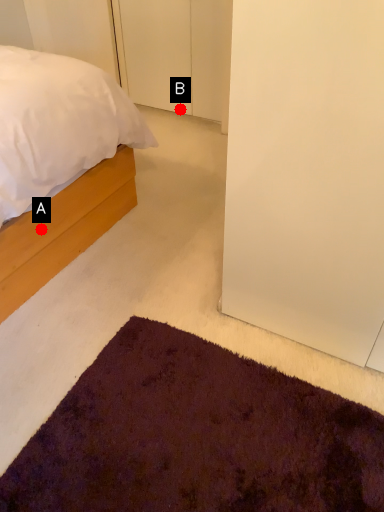
Question: Two points are circled on the image, labeled by A and B beside each circle. Which point appears farthest from the camera in this image?

Choices:
 (A) A is further
 (B) B is further

Answer: (B)